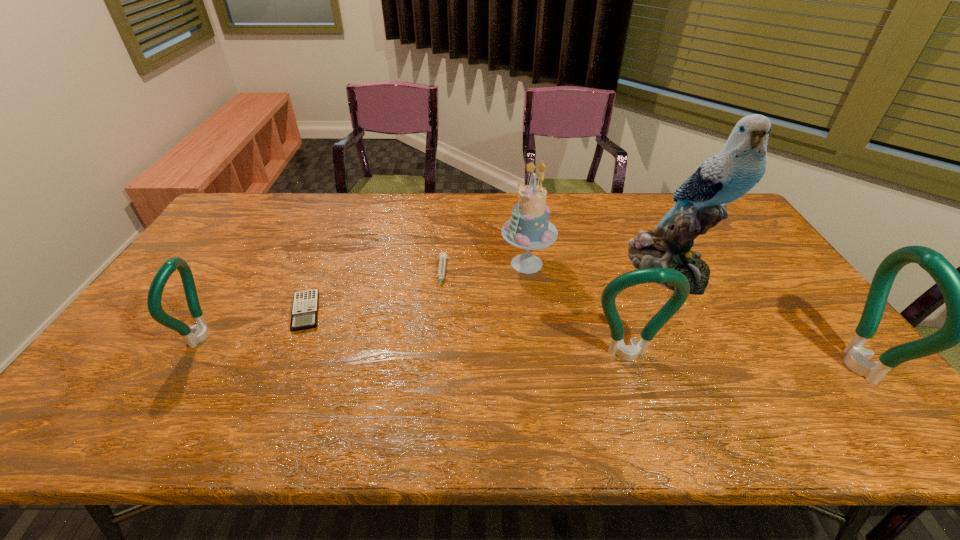
The image size is (960, 540). Find the location of `vacant space that's between the sixth object from left to right and the third object from left to right`. vacant space that's between the sixth object from left to right and the third object from left to right is located at coordinates (556, 272).

This screenshot has width=960, height=540. Identify the location of empty location between the rightmost bottle opener and the sixth object from left to right. (761, 317).

Locate an element on the screen. free space between the fifth object from right to left and the cake is located at coordinates (484, 269).

This screenshot has height=540, width=960. I want to click on vacant region between the second object from left to right and the leftmost object, so click(x=254, y=324).

This screenshot has height=540, width=960. I want to click on vacant area that lies between the rightmost bottle opener and the second bottle opener from left to right, so click(741, 361).

Locate an element on the screen. This screenshot has width=960, height=540. free area in between the syringe and the rightmost bottle opener is located at coordinates (648, 320).

Find the location of a particular element. unoccupied position between the leftmost bottle opener and the rightmost bottle opener is located at coordinates (529, 352).

Where is `free space that is in between the shortest object and the cake`? This screenshot has height=540, width=960. free space that is in between the shortest object and the cake is located at coordinates (417, 288).

Where is `blank region between the third object from right to left and the second object from right to left`? This screenshot has height=540, width=960. blank region between the third object from right to left and the second object from right to left is located at coordinates (648, 312).

Find the location of a particular element. The width and height of the screenshot is (960, 540). the second closest object to the second shortest bottle opener is located at coordinates (529, 228).